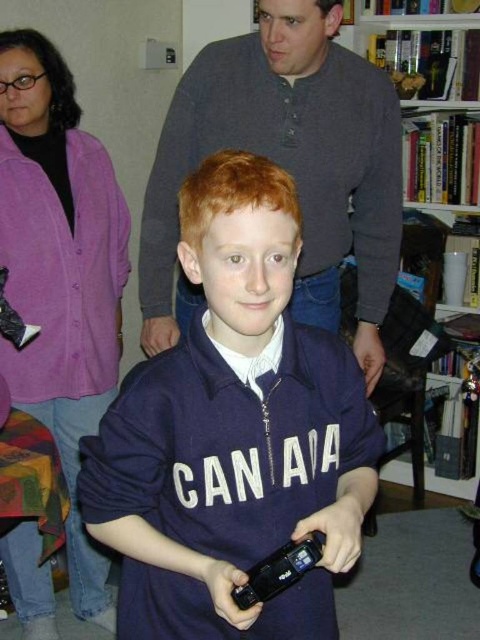
You are standing in a room and want to reach a point that is 33.46 inches away from you. The coordinates of this point are given as point (282, 248). Can you estimate whether this point is within your arm reach?

The point (282, 248) is 33.46 inches away from you. Since the average arm length is about 25 inches, this point is beyond your arm reach.